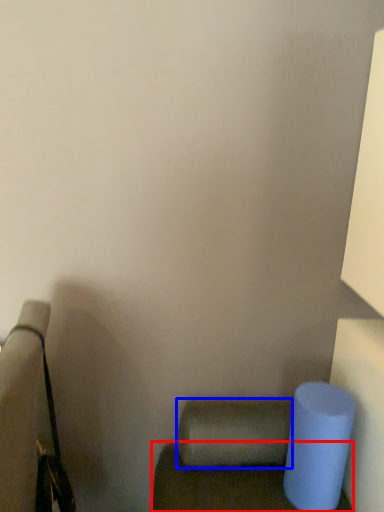
Question: Which of the following is the closest to the observer, furniture (highlighted by a red box) or toilet paper (highlighted by a blue box)?

Choices:
 (A) furniture
 (B) toilet paper

Answer: (A)